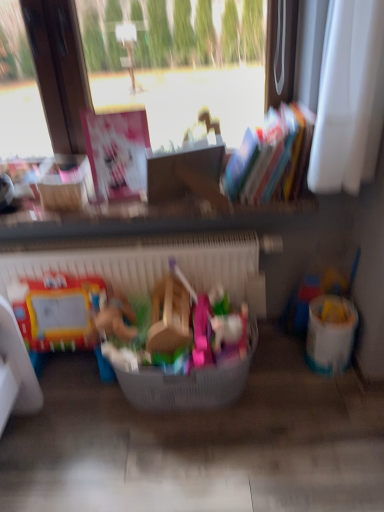
Question: Does translucent plastic bucket at right, the first toy viewed from the back, have a smaller size compared to plastic basket at center, which is counted as the first toy, starting from the front?

Choices:
 (A) yes
 (B) no

Answer: (A)

Question: From the image's perspective, is translucent plastic bucket at right, which is the 1th toy from right to left, above plastic basket at center, positioned as the second toy in right-to-left order?

Choices:
 (A) no
 (B) yes

Answer: (B)

Question: Does translucent plastic bucket at right, the second toy when ordered from front to back, have a lesser width compared to plastic basket at center, the 2th toy viewed from the back?

Choices:
 (A) yes
 (B) no

Answer: (A)

Question: From a real-world perspective, is translucent plastic bucket at right, the second toy when ordered from front to back, positioned under plastic basket at center, the 2th toy viewed from the back, based on gravity?

Choices:
 (A) yes
 (B) no

Answer: (A)

Question: From a real-world perspective, is translucent plastic bucket at right, which is the 1th toy from right to left, positioned over plastic basket at center, the first toy in the left-to-right sequence, based on gravity?

Choices:
 (A) yes
 (B) no

Answer: (B)

Question: Does point (314, 338) appear closer or farther from the camera than point (185, 375)?

Choices:
 (A) closer
 (B) farther

Answer: (B)

Question: Choose the correct answer: Is white plastic bucket at right inside plastic basket at center or outside it?

Choices:
 (A) inside
 (B) outside

Answer: (B)

Question: In terms of width, does white plastic bucket at right look wider or thinner when compared to plastic basket at center?

Choices:
 (A) thin
 (B) wide

Answer: (A)

Question: From the image's perspective, is white plastic bucket at right above or below plastic basket at center?

Choices:
 (A) above
 (B) below

Answer: (A)

Question: Considering the positions of multicolored paper book at upper right and plastic basket at center in the image, is multicolored paper book at upper right wider or thinner than plastic basket at center?

Choices:
 (A) wide
 (B) thin

Answer: (B)

Question: Looking at the image, does multicolored paper book at upper right seem bigger or smaller compared to plastic basket at center?

Choices:
 (A) small
 (B) big

Answer: (A)

Question: From the image's perspective, is multicolored paper book at upper right above or below plastic basket at center?

Choices:
 (A) below
 (B) above

Answer: (B)

Question: Is multicolored paper book at upper right inside the boundaries of plastic basket at center, or outside?

Choices:
 (A) outside
 (B) inside

Answer: (A)

Question: Is translucent plastic bucket at right, the first toy viewed from the back, inside the boundaries of white plastic radiator at center, or outside?

Choices:
 (A) inside
 (B) outside

Answer: (B)

Question: Is translucent plastic bucket at right, the second toy when ordered from front to back, bigger or smaller than white plastic radiator at center?

Choices:
 (A) small
 (B) big

Answer: (A)